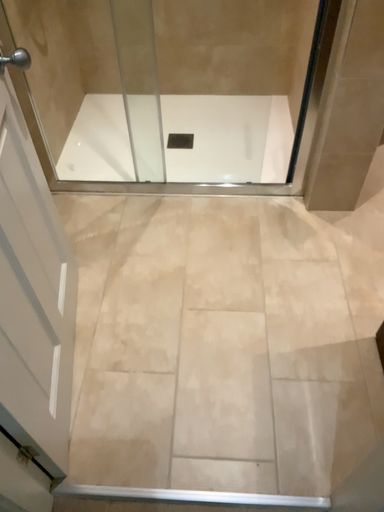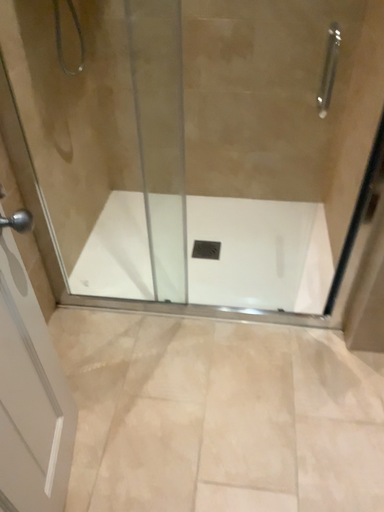
Question: Which way did the camera rotate in the video?

Choices:
 (A) rotated upward
 (B) rotated downward

Answer: (A)